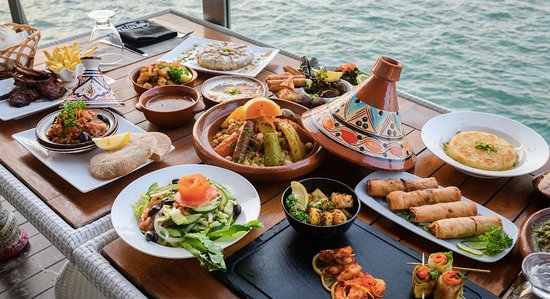
This screenshot has height=299, width=550. Identify the location of glass. (114, 29), (540, 261).